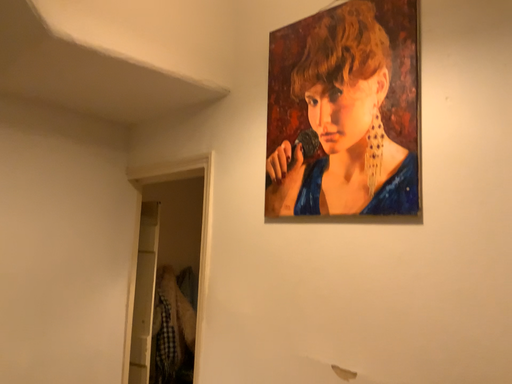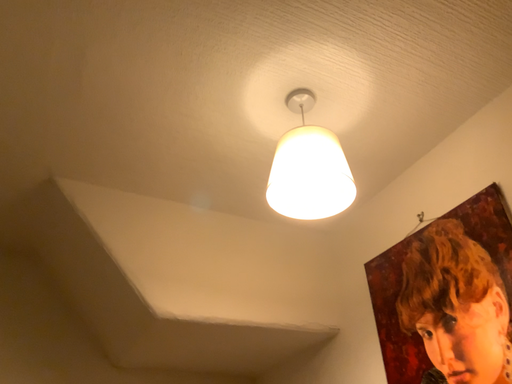
Question: Which way did the camera rotate in the video?

Choices:
 (A) rotated left
 (B) rotated right

Answer: (A)